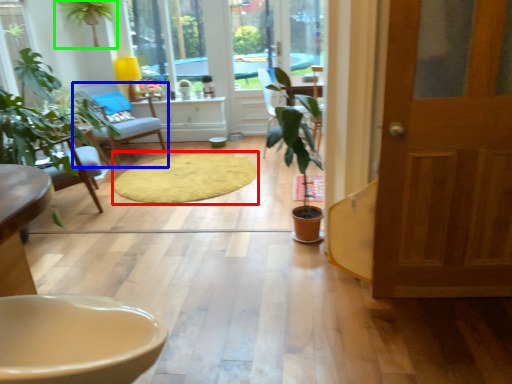
Question: Which object is positioned farthest from mat (highlighted by a red box)? Select from chair (highlighted by a blue box) and houseplant (highlighted by a green box).

Choices:
 (A) chair
 (B) houseplant

Answer: (B)